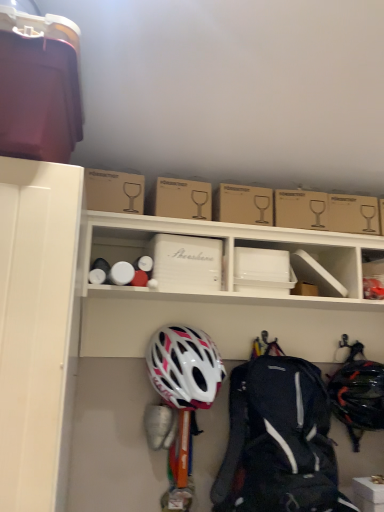
Question: From a real-world perspective, is white plastic storage box at upper right, positioned as the third storage box in left-to-right order, physically located above or below brown cardboard box at upper center, the 2th cardboard box viewed from the right?

Choices:
 (A) below
 (B) above

Answer: (A)

Question: Would you say white plastic storage box at upper right, the 1th storage box positioned from the right, is inside or outside brown cardboard box at upper center, which appears as the third cardboard box when viewed from the left?

Choices:
 (A) outside
 (B) inside

Answer: (A)

Question: Which is nearer to the white matte storage box at lower right, which is the 2th storage box in left-to-right order?

Choices:
 (A) matte plastic bin at upper left
 (B) brown cardboard box at upper center, placed as the fourth cardboard box when sorted from right to left
 (C) white plastic storage box at center, the 1th storage box from the top
 (D) white matte cardboard box at center, which ranks as the 3th cardboard box in right-to-left order
 (E) brown cardboard box at upper center, which appears as the third cardboard box when viewed from the left

Answer: (C)

Question: Which object is the closest to the black matte helmet at lower right, acting as the 2th helmet starting from the left?

Choices:
 (A) white matte storage box at center
 (B) brown cardboard box at upper center, placed as the fourth cardboard box when sorted from right to left
 (C) matte black backpack at center
 (D) white matte storage box at lower right, which ranks as the 3th storage box in top-to-bottom order
 (E) white matte helmet at center, the 2th helmet when ordered from right to left

Answer: (D)